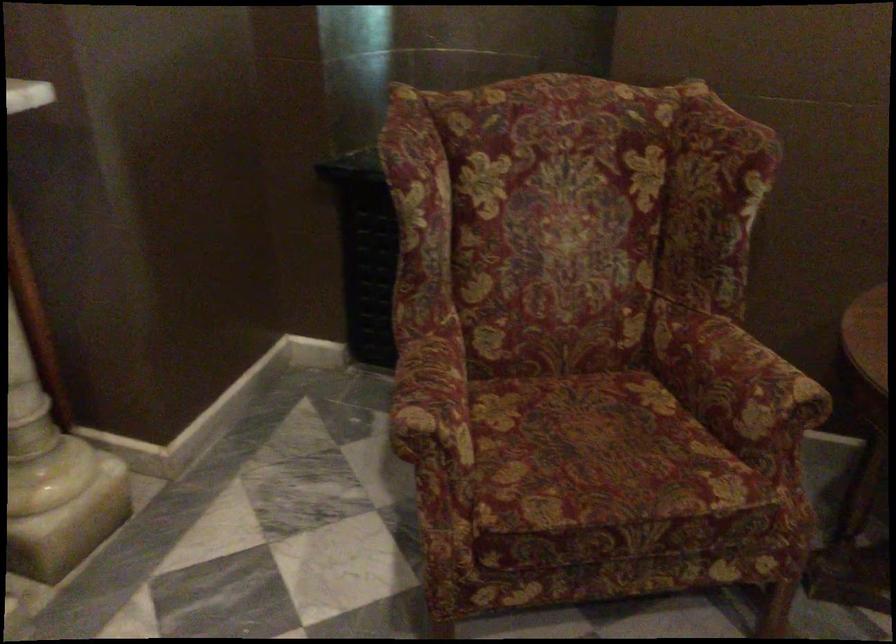
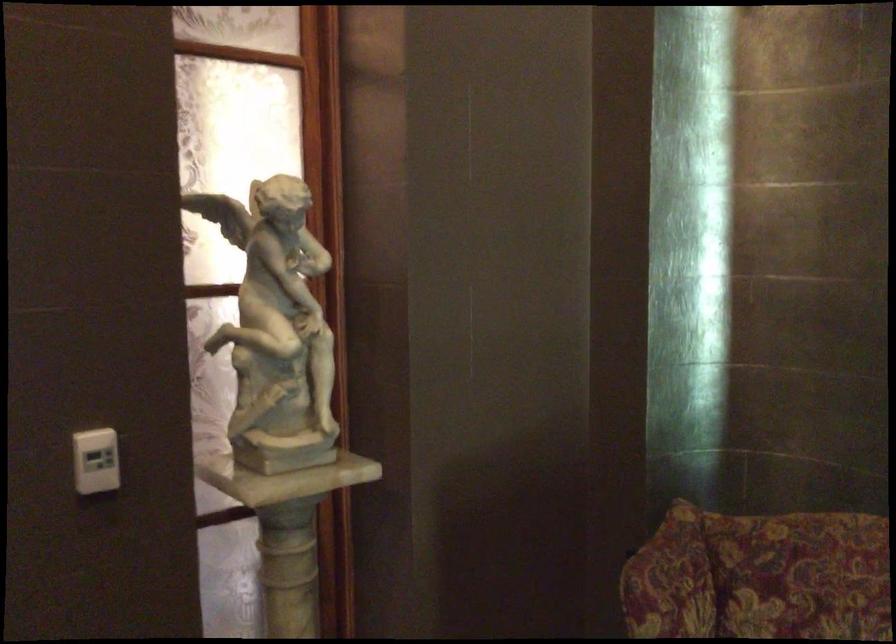
First-person continuous shooting, in which direction is the camera rotating?

The camera rotated toward left-up.